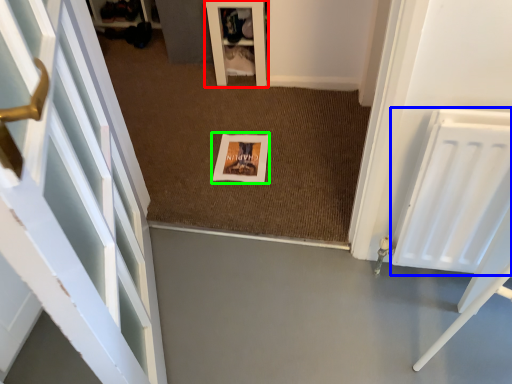
Question: Considering the real-world distances, which object is closest to furniture (highlighted by a red box)? radiator (highlighted by a blue box) or picture frame (highlighted by a green box).

Choices:
 (A) radiator
 (B) picture frame

Answer: (B)